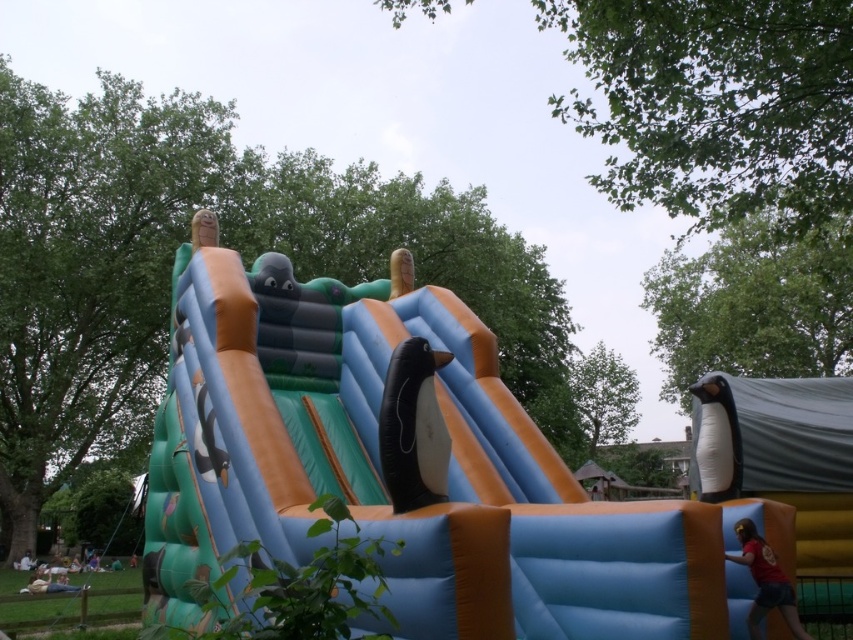
You are standing at the base of the inflatable slide and want to reach the top platform where the large inflatable penguin is located. The path to the top goes through point (705, 378). If you start walking from your current position, how far will you have to walk to reach the top platform?

The distance between point (705, 378) and the viewer is 6.25 meters, so you will have to walk 6.25 meters to reach the top platform.